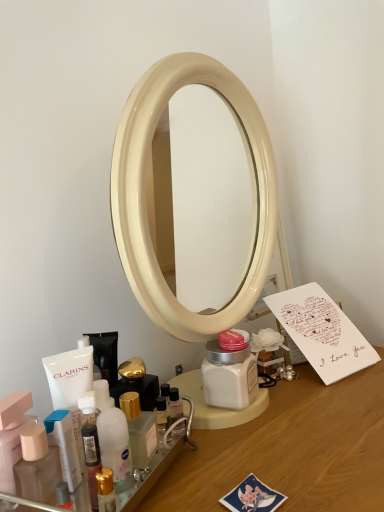
Question: Does matte plastic bottle at lower left, which is counted as the second toiletry, starting from the right, have a smaller size compared to white paper card at right?

Choices:
 (A) yes
 (B) no

Answer: (A)

Question: Is matte plastic bottle at lower left, which is the second toiletry from left to right, closer to the viewer compared to white paper card at right?

Choices:
 (A) no
 (B) yes

Answer: (B)

Question: Can you confirm if matte plastic bottle at lower left, which is the second toiletry from left to right, is positioned to the left of white paper card at right?

Choices:
 (A) yes
 (B) no

Answer: (A)

Question: Considering the relative sizes of matte plastic bottle at lower left, which is the second toiletry from left to right, and white paper card at right in the image provided, is matte plastic bottle at lower left, which is the second toiletry from left to right, thinner than white paper card at right?

Choices:
 (A) no
 (B) yes

Answer: (B)

Question: Considering the relative sizes of matte plastic bottle at lower left, which is counted as the second toiletry, starting from the right, and white paper card at right in the image provided, is matte plastic bottle at lower left, which is counted as the second toiletry, starting from the right, wider than white paper card at right?

Choices:
 (A) no
 (B) yes

Answer: (A)

Question: Is matte plastic bottle at lower left, which is the second toiletry from left to right, shorter than white paper card at right?

Choices:
 (A) no
 (B) yes

Answer: (B)

Question: Does wooden desk at center have a larger size compared to matte pink container at lower left, placed as the 3th toiletry when sorted from right to left?

Choices:
 (A) yes
 (B) no

Answer: (A)

Question: Is there a large distance between wooden desk at center and matte pink container at lower left, marked as the 1th toiletry in a left-to-right arrangement?

Choices:
 (A) yes
 (B) no

Answer: (B)

Question: Is wooden desk at center further to camera compared to matte pink container at lower left, marked as the 1th toiletry in a left-to-right arrangement?

Choices:
 (A) no
 (B) yes

Answer: (A)

Question: Is wooden desk at center outside of matte pink container at lower left, placed as the 3th toiletry when sorted from right to left?

Choices:
 (A) yes
 (B) no

Answer: (A)

Question: Considering the relative sizes of wooden desk at center and matte pink container at lower left, placed as the 3th toiletry when sorted from right to left, in the image provided, is wooden desk at center smaller than matte pink container at lower left, placed as the 3th toiletry when sorted from right to left,?

Choices:
 (A) yes
 (B) no

Answer: (B)

Question: Can you confirm if wooden desk at center is shorter than matte pink container at lower left, marked as the 1th toiletry in a left-to-right arrangement?

Choices:
 (A) yes
 (B) no

Answer: (B)

Question: Can you confirm if wooden desk at center is wider than white paper card at right?

Choices:
 (A) no
 (B) yes

Answer: (B)